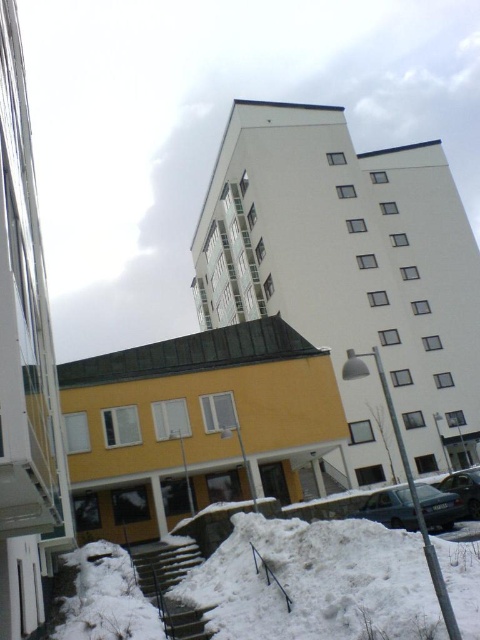
Question: Is snow-covered concrete stairs at lower left below metallic silver car at center?

Choices:
 (A) no
 (B) yes

Answer: (B)

Question: Is white smooth building at upper center closer to camera compared to metallic silver car at center?

Choices:
 (A) yes
 (B) no

Answer: (B)

Question: Is yellow matte building at left positioned at the back of snow-covered concrete stairs at lower left?

Choices:
 (A) no
 (B) yes

Answer: (A)

Question: Which object is the closest to the yellow matte building at lower left?

Choices:
 (A) white smooth building at upper center
 (B) metallic silver car at center
 (C) yellow matte building at left

Answer: (C)

Question: Which point is farther from the camera taking this photo?

Choices:
 (A) (447, 476)
 (B) (371, 268)
 (C) (165, 627)
 (D) (24, 604)

Answer: (B)

Question: Which is farther from the yellow matte building at left?

Choices:
 (A) metallic silver car at center
 (B) white smooth building at upper center
 (C) yellow matte building at lower left
 (D) teal metallic car at lower right

Answer: (B)